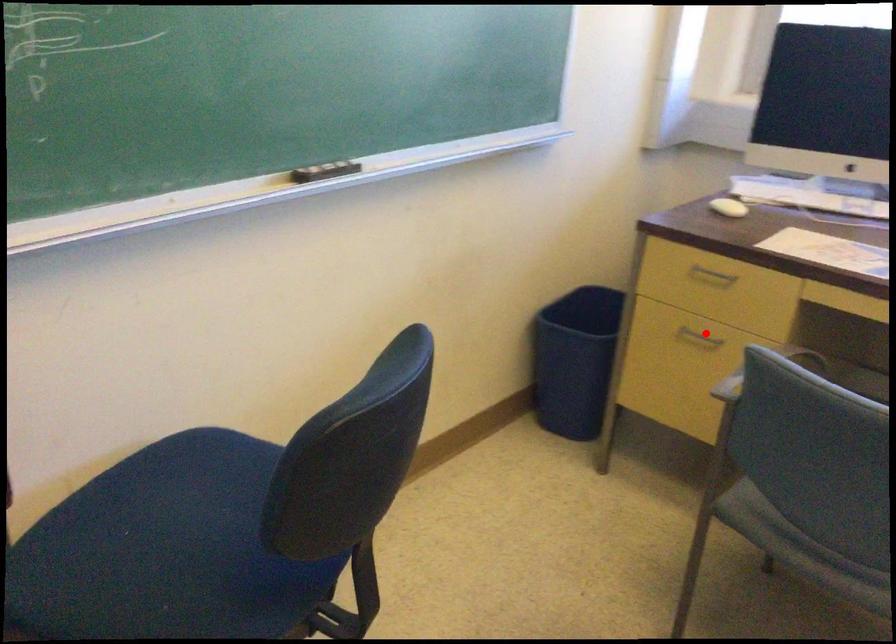
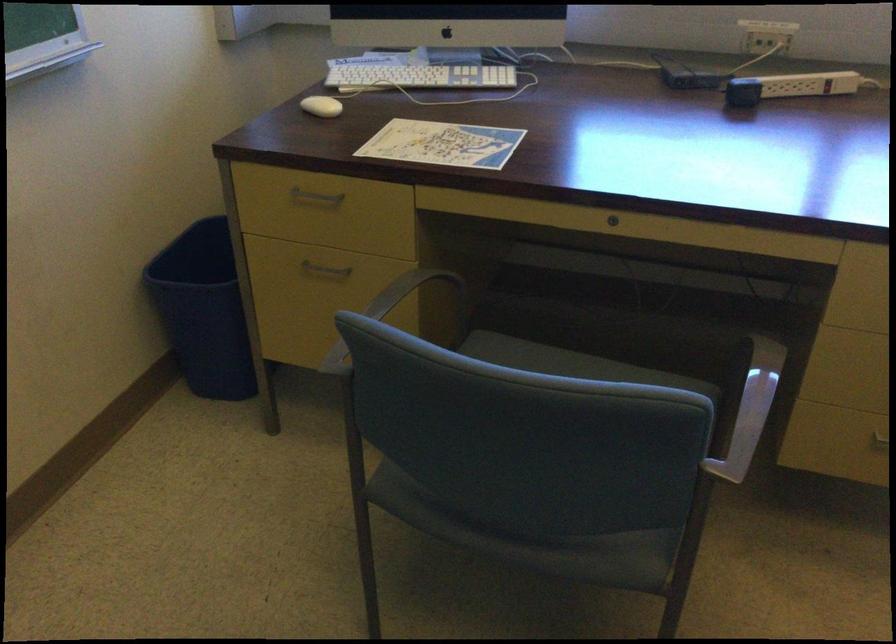
Where in the second image is the point corresponding to the highlighted location from the first image?

(324, 269)